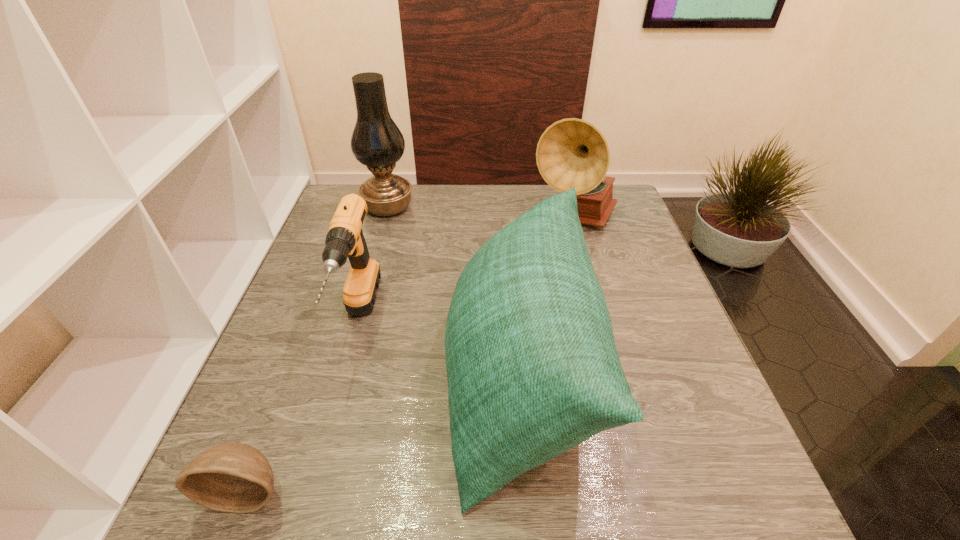
In order to click on object present at the far left corner in this screenshot , I will do `click(376, 142)`.

Identify the location of object situated at the near left corner. This screenshot has height=540, width=960. (233, 477).

Identify the location of object that is at the far right corner. (572, 152).

At what (x,y) coordinates should I click in order to perform the action: click on free region at the far edge of the desktop. Please return your answer as a coordinate pair (x, y). This screenshot has height=540, width=960. Looking at the image, I should click on (468, 185).

Locate an element on the screen. The height and width of the screenshot is (540, 960). vacant space at the near edge of the desktop is located at coordinates (531, 517).

In the image, there is a desktop. At what (x,y) coordinates should I click in order to perform the action: click on free region at the left edge. Please return your answer as a coordinate pair (x, y). The height and width of the screenshot is (540, 960). Looking at the image, I should click on (269, 406).

In the image, there is a desktop. Identify the location of vacant space at the right edge. The height and width of the screenshot is (540, 960). (647, 420).

Locate an element on the screen. This screenshot has height=540, width=960. vacant space at the near left corner of the desktop is located at coordinates (236, 517).

The image size is (960, 540). In the image, there is a desktop. In order to click on vacant space at the near right corner in this screenshot , I will do `click(719, 511)`.

The image size is (960, 540). In order to click on free space between the phonograph record and the oil lamp in this screenshot , I will do `click(481, 214)`.